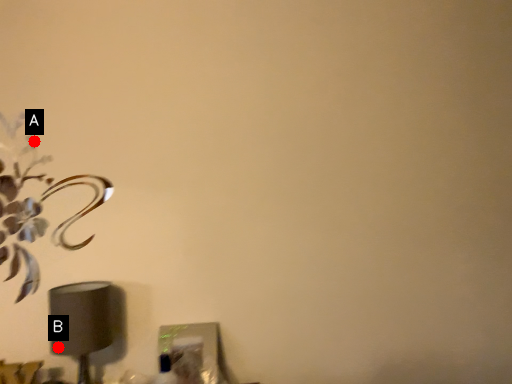
Question: Two points are circled on the image, labeled by A and B beside each circle. Which of the following is the closest to the observer?

Choices:
 (A) A is closer
 (B) B is closer

Answer: (B)